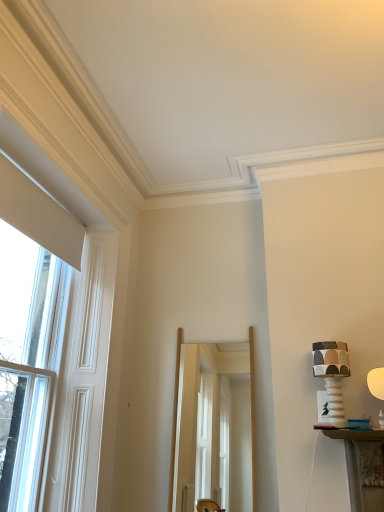
Question: Is matte ceramic lampshade at right, which ranks as the second table lamp in left-to-right order, thinner than clear glass screen door at center?

Choices:
 (A) yes
 (B) no

Answer: (A)

Question: From a real-world perspective, does matte ceramic lampshade at right, which ranks as the second table lamp in left-to-right order, stand above clear glass screen door at center?

Choices:
 (A) no
 (B) yes

Answer: (B)

Question: Would you say matte ceramic lampshade at right, positioned as the first table lamp in right-to-left order, contains clear glass screen door at center?

Choices:
 (A) no
 (B) yes

Answer: (A)

Question: Considering the relative sizes of matte ceramic lampshade at right, positioned as the first table lamp in right-to-left order, and clear glass screen door at center in the image provided, is matte ceramic lampshade at right, positioned as the first table lamp in right-to-left order, smaller than clear glass screen door at center?

Choices:
 (A) no
 (B) yes

Answer: (B)

Question: Is matte ceramic lampshade at right, which ranks as the second table lamp in left-to-right order, located outside clear glass screen door at center?

Choices:
 (A) no
 (B) yes

Answer: (B)

Question: Considering the relative sizes of matte ceramic lampshade at right, which ranks as the second table lamp in left-to-right order, and clear glass screen door at center in the image provided, is matte ceramic lampshade at right, which ranks as the second table lamp in left-to-right order, bigger than clear glass screen door at center?

Choices:
 (A) no
 (B) yes

Answer: (A)

Question: Could clear glass window at left be considered to be inside clear glass screen door at center?

Choices:
 (A) no
 (B) yes

Answer: (A)

Question: From a real-world perspective, is clear glass screen door at center located beneath clear glass window at left?

Choices:
 (A) yes
 (B) no

Answer: (A)

Question: Is clear glass screen door at center shorter than clear glass window at left?

Choices:
 (A) no
 (B) yes

Answer: (B)

Question: Is clear glass screen door at center taller than clear glass window at left?

Choices:
 (A) yes
 (B) no

Answer: (B)

Question: Can you confirm if clear glass screen door at center is smaller than clear glass window at left?

Choices:
 (A) yes
 (B) no

Answer: (A)

Question: Does clear glass screen door at center appear on the left side of clear glass window at left?

Choices:
 (A) yes
 (B) no

Answer: (B)

Question: Considering the relative positions of matte ceramic lampshade at right, positioned as the first table lamp in right-to-left order, and clear glass window at left in the image provided, is matte ceramic lampshade at right, positioned as the first table lamp in right-to-left order, behind clear glass window at left?

Choices:
 (A) yes
 (B) no

Answer: (A)